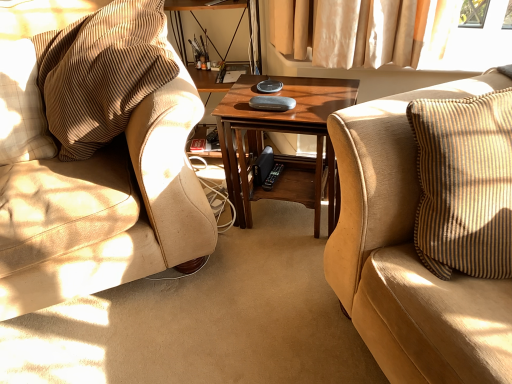
Question: From their relative heights in the image, would you say suede beige couch at right is taller or shorter than beige textured pillow at left?

Choices:
 (A) tall
 (B) short

Answer: (A)

Question: Looking at the image, does suede beige couch at right seem bigger or smaller compared to beige textured pillow at left?

Choices:
 (A) big
 (B) small

Answer: (A)

Question: Which is farther from the brown corduroy chair at left?

Choices:
 (A) wooden coffee table at center
 (B) beige textured pillow at left
 (C) suede beige couch at right

Answer: (C)

Question: Considering the real-world distances, which object is closest to the wooden coffee table at center?

Choices:
 (A) brown corduroy chair at left
 (B) suede beige couch at right
 (C) beige textured pillow at left

Answer: (A)